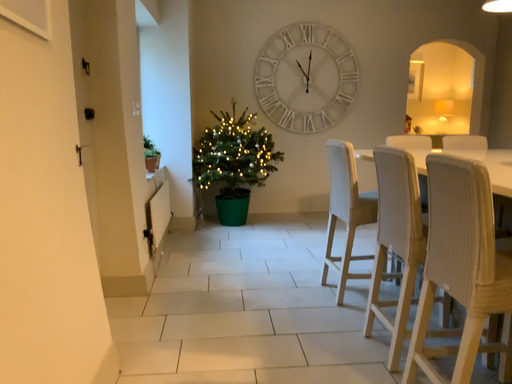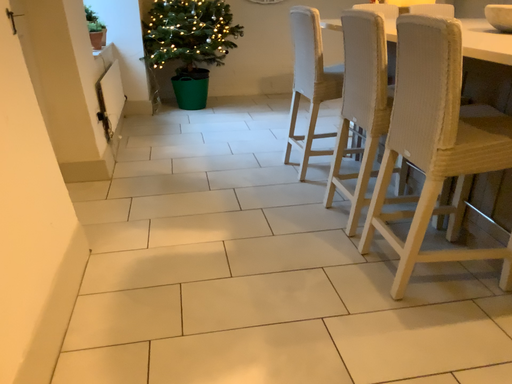
Question: How did the camera likely rotate when shooting the video?

Choices:
 (A) rotated downward
 (B) rotated upward

Answer: (A)